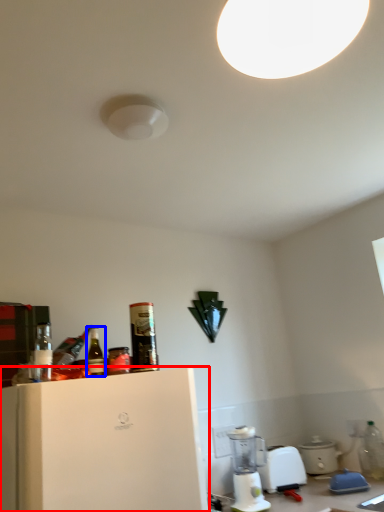
Question: Among these objects, which one is farthest to the camera, home appliance (highlighted by a red box) or bottle (highlighted by a blue box)?

Choices:
 (A) home appliance
 (B) bottle

Answer: (B)